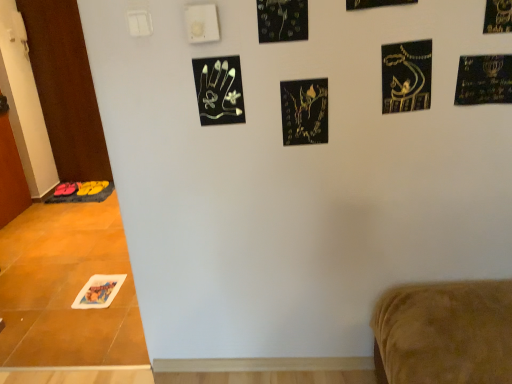
The image size is (512, 384). In order to click on white glossy door at left, the first door viewed from the front in this screenshot , I will do `click(25, 106)`.

Identify the location of gold metallic calligraphy at upper right, which ranks as the 5th print in left-to-right order. (406, 76).

Describe the element at coordinates (498, 16) in the screenshot. I see `black matte print at upper right, the 1th print from the top` at that location.

At what (x,y) coordinates should I click in order to perform the action: click on printed paper at lower left, positioned as the 6th print in front-to-back order. Please return your answer as a coordinate pair (x, y). The image size is (512, 384). Looking at the image, I should click on (99, 291).

Measure the distance between black matte print at center, placed as the second print when sorted from back to front, and camera.

1.32 meters.

What do you see at coordinates (282, 20) in the screenshot? I see `black glossy leaves at upper center, arranged as the third print when viewed from the left` at bounding box center [282, 20].

The height and width of the screenshot is (384, 512). What do you see at coordinates (484, 80) in the screenshot?
I see `gold metallic menorah at upper right` at bounding box center [484, 80].

At what (x,y) coordinates should I click in order to perform the action: click on white glossy door at left, the first door viewed from the front. Please return your answer as a coordinate pair (x, y). The height and width of the screenshot is (384, 512). Looking at the image, I should click on tap(25, 106).

Considering the relative sizes of white glossy door at left, which is the 2th door in back-to-front order, and black matte print at center, placed as the 5th print when sorted from front to back, in the image provided, is white glossy door at left, which is the 2th door in back-to-front order, bigger than black matte print at center, placed as the 5th print when sorted from front to back,?

Yes.

Which is in front, white glossy door at left, the first door viewed from the front, or black matte print at center, the third print when ordered from right to left?

Positioned in front is black matte print at center, the third print when ordered from right to left.

Is white glossy door at left, the first door viewed from the front, with black matte print at center, placed as the 5th print when sorted from front to back?

No, white glossy door at left, the first door viewed from the front, is not touching black matte print at center, placed as the 5th print when sorted from front to back.

From a real-world perspective, between white glossy door at left, which is the 2th door in back-to-front order, and black matte print at center, placed as the second print when sorted from back to front, who is vertically higher?

In real-world perspective, black matte print at center, placed as the second print when sorted from back to front, is above.

From the picture: Does white glossy door at left, which is the 2th door in back-to-front order, have a lesser width compared to black metallic handprint at upper center, positioned as the 5th print in right-to-left order?

No.

From the image's perspective, is white glossy door at left, the first door viewed from the front, positioned above or below black metallic handprint at upper center, the 2th print from the left?

white glossy door at left, the first door viewed from the front, is above black metallic handprint at upper center, the 2th print from the left.

Is white glossy door at left, which is the 2th door in back-to-front order, not near black metallic handprint at upper center, positioned as the 4th print in front-to-back order?

Yes.

Considering the relative sizes of black matte print at center, the 4th print when ordered from left to right, and gold metallic menorah at upper right in the image provided, is black matte print at center, the 4th print when ordered from left to right, shorter than gold metallic menorah at upper right?

Incorrect, the height of black matte print at center, the 4th print when ordered from left to right, does not fall short of that of gold metallic menorah at upper right.

Is black matte print at center, placed as the 5th print when sorted from front to back, oriented away from gold metallic menorah at upper right?

black matte print at center, placed as the 5th print when sorted from front to back, does not have its back to gold metallic menorah at upper right.

Looking at this image, are black matte print at center, placed as the 5th print when sorted from front to back, and gold metallic menorah at upper right making contact?

No, black matte print at center, placed as the 5th print when sorted from front to back, is not next to gold metallic menorah at upper right.

Consider the image. Considering the sizes of objects black matte print at center, the third print when ordered from right to left, and gold metallic menorah at upper right in the image provided, who is bigger, black matte print at center, the third print when ordered from right to left, or gold metallic menorah at upper right?

With larger size is gold metallic menorah at upper right.

Could you tell me if black glossy leaves at upper center, arranged as the third print when viewed from the left, is turned towards black matte print at upper right, acting as the 6th print starting from the left?

No, black glossy leaves at upper center, arranged as the third print when viewed from the left, does not turn towards black matte print at upper right, acting as the 6th print starting from the left.

Is black glossy leaves at upper center, which is counted as the 5th print, starting from the bottom, positioned far away from black matte print at upper right, the 1th print from the top?

black glossy leaves at upper center, which is counted as the 5th print, starting from the bottom, is actually quite close to black matte print at upper right, the 1th print from the top.

Can you tell me how much black glossy leaves at upper center, acting as the 2th print starting from the top, and black matte print at upper right, which appears as the sixth print when ordered from the bottom, differ in facing direction?

There is a 2.22-degree angle between the facing directions of black glossy leaves at upper center, acting as the 2th print starting from the top, and black matte print at upper right, which appears as the sixth print when ordered from the bottom.

From the picture: From a real-world perspective, which is physically below, black glossy leaves at upper center, the second print positioned from the front, or black matte print at upper right, which appears as the sixth print when ordered from the bottom?

black matte print at upper right, which appears as the sixth print when ordered from the bottom, is physically lower.

Is point (42, 32) positioned before point (410, 95)?

No, it is behind (410, 95).

Looking at this image, does brown wood door at left, placed as the first door when sorted from back to front, have a smaller size compared to gold metallic calligraphy at upper right, the fourth print in the bottom-to-top sequence?

No, brown wood door at left, placed as the first door when sorted from back to front, is not smaller than gold metallic calligraphy at upper right, the fourth print in the bottom-to-top sequence.

Looking at this image, is the position of brown wood door at left, positioned as the second door in front-to-back order, more distant than that of gold metallic calligraphy at upper right, which is counted as the third print, starting from the top?

Yes, it is.

Is gold metallic calligraphy at upper right, which appears as the fourth print when viewed from the back, inside brown wood door at left, positioned as the second door in front-to-back order?

No, gold metallic calligraphy at upper right, which appears as the fourth print when viewed from the back, is located outside of brown wood door at left, positioned as the second door in front-to-back order.

Is white glossy door at left, which is the 2th door in back-to-front order, taller than gold metallic calligraphy at upper right, which appears as the fourth print when viewed from the back?

Correct, white glossy door at left, which is the 2th door in back-to-front order, is much taller as gold metallic calligraphy at upper right, which appears as the fourth print when viewed from the back.

Considering the sizes of white glossy door at left, the first door viewed from the front, and gold metallic calligraphy at upper right, which ranks as the 5th print in left-to-right order, in the image, is white glossy door at left, the first door viewed from the front, bigger or smaller than gold metallic calligraphy at upper right, which ranks as the 5th print in left-to-right order,?

Clearly, white glossy door at left, the first door viewed from the front, is larger in size than gold metallic calligraphy at upper right, which ranks as the 5th print in left-to-right order.

From a real-world perspective, which object stands above the other?

gold metallic calligraphy at upper right, the fourth print in the bottom-to-top sequence, from a real-world perspective.

In terms of width, does white glossy door at left, which is the 2th door in back-to-front order, look wider or thinner when compared to gold metallic calligraphy at upper right, the fourth print in the bottom-to-top sequence?

In the image, white glossy door at left, which is the 2th door in back-to-front order, appears to be wider than gold metallic calligraphy at upper right, the fourth print in the bottom-to-top sequence.

Is black glossy leaves at upper center, acting as the fourth print starting from the right, outside of printed paper at lower left, positioned as the 6th print in front-to-back order?

Yes, black glossy leaves at upper center, acting as the fourth print starting from the right, is outside of printed paper at lower left, positioned as the 6th print in front-to-back order.

From the picture: Is black glossy leaves at upper center, arranged as the third print when viewed from the left, taller than printed paper at lower left, which is the sixth print from top to bottom?

Correct, black glossy leaves at upper center, arranged as the third print when viewed from the left, is much taller as printed paper at lower left, which is the sixth print from top to bottom.

From a real-world perspective, is black glossy leaves at upper center, placed as the 5th print when sorted from back to front, located beneath printed paper at lower left, the first print positioned from the left?

Incorrect, from a real-world perspective, black glossy leaves at upper center, placed as the 5th print when sorted from back to front, is higher than printed paper at lower left, the first print positioned from the left.

Which of these two, black glossy leaves at upper center, the second print positioned from the front, or printed paper at lower left, placed as the first print when sorted from back to front, is bigger?

Bigger between the two is printed paper at lower left, placed as the first print when sorted from back to front.

The image size is (512, 384). What are the coordinates of `the 1st door behind when counting from the black matte print at center, placed as the 5th print when sorted from front to back` in the screenshot? It's located at (25, 106).

Where is `the 3rd print in front of the white glossy door at left, which is the 2th door in back-to-front order`? the 3rd print in front of the white glossy door at left, which is the 2th door in back-to-front order is located at coordinates (219, 90).

Which object lies nearer to the anchor point black matte print at center, marked as the fifth print in a top-to-bottom arrangement, printed paper at lower left, positioned as the 6th print in front-to-back order, or brown wood door at left, placed as the first door when sorted from back to front?

The object closer to black matte print at center, marked as the fifth print in a top-to-bottom arrangement, is printed paper at lower left, positioned as the 6th print in front-to-back order.

Which object lies nearer to the anchor point white glossy door at left, which is the 2th door in back-to-front order, gold metallic menorah at upper right or black metallic handprint at upper center, positioned as the 4th print in top-to-bottom order?

Among the two, black metallic handprint at upper center, positioned as the 4th print in top-to-bottom order, is located nearer to white glossy door at left, which is the 2th door in back-to-front order.

Consider the image. Estimate the real-world distances between objects in this image. Which object is closer to black metallic handprint at upper center, positioned as the 5th print in right-to-left order, brown wood door at left, placed as the first door when sorted from back to front, or black glossy leaves at upper center, acting as the fourth print starting from the right?

black glossy leaves at upper center, acting as the fourth print starting from the right, lies closer to black metallic handprint at upper center, positioned as the 5th print in right-to-left order, than the other object.

Which object lies further to the anchor point white glossy door at left, which is the 2th door in back-to-front order, printed paper at lower left, placed as the first print when sorted from back to front, or gold metallic calligraphy at upper right, which is counted as the third print, starting from the top?

The object further to white glossy door at left, which is the 2th door in back-to-front order, is gold metallic calligraphy at upper right, which is counted as the third print, starting from the top.

Estimate the real-world distances between objects in this image. Which object is further from black glossy leaves at upper center, arranged as the third print when viewed from the left, gold metallic calligraphy at upper right, positioned as the 2th print in right-to-left order, or gold metallic menorah at upper right?

The object further to black glossy leaves at upper center, arranged as the third print when viewed from the left, is gold metallic menorah at upper right.

Considering their positions, is black matte print at center, which is the second print in bottom-to-top order, positioned closer to gold metallic menorah at upper right than gold metallic calligraphy at upper right, positioned as the 2th print in right-to-left order?

Among the two, gold metallic calligraphy at upper right, positioned as the 2th print in right-to-left order, is located nearer to gold metallic menorah at upper right.

Looking at the image, which one is located closer to gold metallic menorah at upper right, printed paper at lower left, which is the sixth print from top to bottom, or gold metallic calligraphy at upper right, which ranks as the 5th print in left-to-right order?

Based on the image, gold metallic calligraphy at upper right, which ranks as the 5th print in left-to-right order, appears to be nearer to gold metallic menorah at upper right.

Based on their spatial positions, is gold metallic menorah at upper right or gold metallic calligraphy at upper right, positioned as the 2th print in right-to-left order, further from printed paper at lower left, arranged as the first print when ordered from the bottom?

Based on the image, gold metallic menorah at upper right appears to be further to printed paper at lower left, arranged as the first print when ordered from the bottom.

Locate an element on the screen. The width and height of the screenshot is (512, 384). postcard between black matte print at center, placed as the second print when sorted from back to front, and black matte print at upper right, the 1th print from the right, in the horizontal direction is located at coordinates (484, 80).

The width and height of the screenshot is (512, 384). I want to click on postcard between printed paper at lower left, placed as the first print when sorted from back to front, and black matte print at upper right, acting as the 6th print starting from the left, so click(x=484, y=80).

Locate an element on the screen. door situated between white glossy door at left, which is the 2th door in back-to-front order, and black matte print at upper right, the first print when ordered from front to back, from left to right is located at coordinates (66, 89).

Locate an element on the screen. The height and width of the screenshot is (384, 512). postcard between brown wood door at left, placed as the first door when sorted from back to front, and black matte print at upper right, which appears as the sixth print when ordered from the bottom is located at coordinates (484, 80).